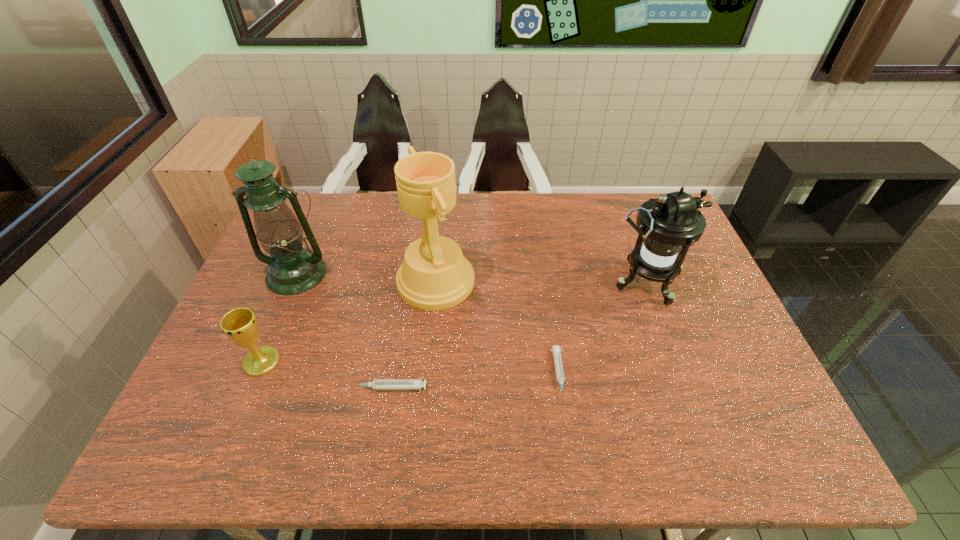
Locate an element on the screen. the left syringe is located at coordinates (377, 384).

The width and height of the screenshot is (960, 540). Find the location of `the fifth tallest object`. the fifth tallest object is located at coordinates (377, 384).

Where is `the right syringe`? The height and width of the screenshot is (540, 960). the right syringe is located at coordinates (556, 349).

Where is `the shortest object`? The height and width of the screenshot is (540, 960). the shortest object is located at coordinates (556, 349).

The width and height of the screenshot is (960, 540). In order to click on award in this screenshot , I will do `click(434, 275)`.

You are a GUI agent. You are given a task and a screenshot of the screen. Output one action in this format:
    pyautogui.click(x=<x>, y=<y>)
    Task: Click on the fourth tallest object
    
    Given the screenshot: What is the action you would take?
    pyautogui.click(x=240, y=325)

Find the location of a particular element. This screenshot has width=960, height=540. oil lamp is located at coordinates (292, 269).

Identify the location of lantern. (668, 225).

Locate an element on the screen. Image resolution: width=960 pixels, height=540 pixels. the fourth shortest object is located at coordinates (668, 225).

Where is `free region located at the needle end of the left syringe`? Image resolution: width=960 pixels, height=540 pixels. free region located at the needle end of the left syringe is located at coordinates (245, 388).